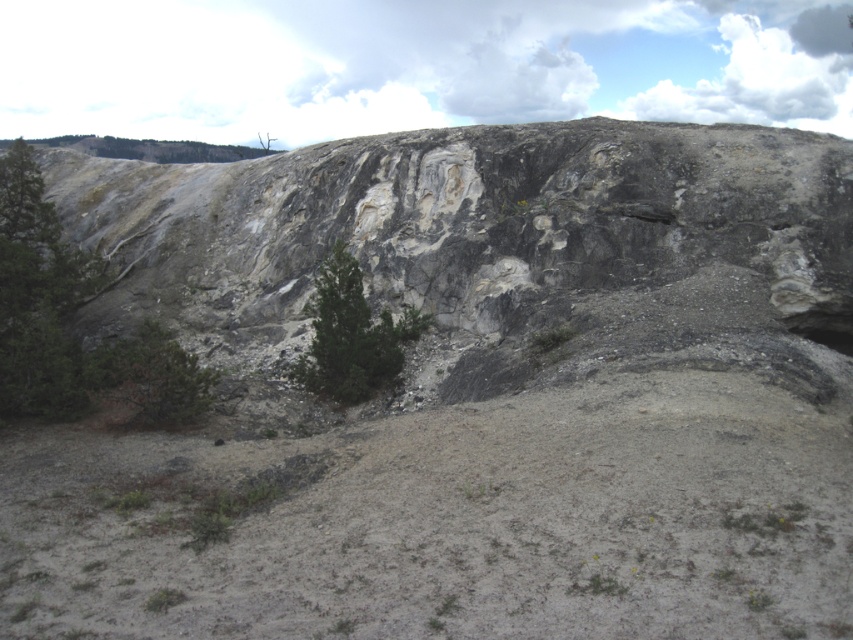
Does green matte tree at left have a smaller size compared to green matte tree at center?

No, green matte tree at left is not smaller than green matte tree at center.

Consider the image. Which of these two, green matte tree at left or green matte tree at center, stands shorter?

green matte tree at center is shorter.

The height and width of the screenshot is (640, 853). In order to click on green matte tree at left in this screenshot , I will do `click(67, 320)`.